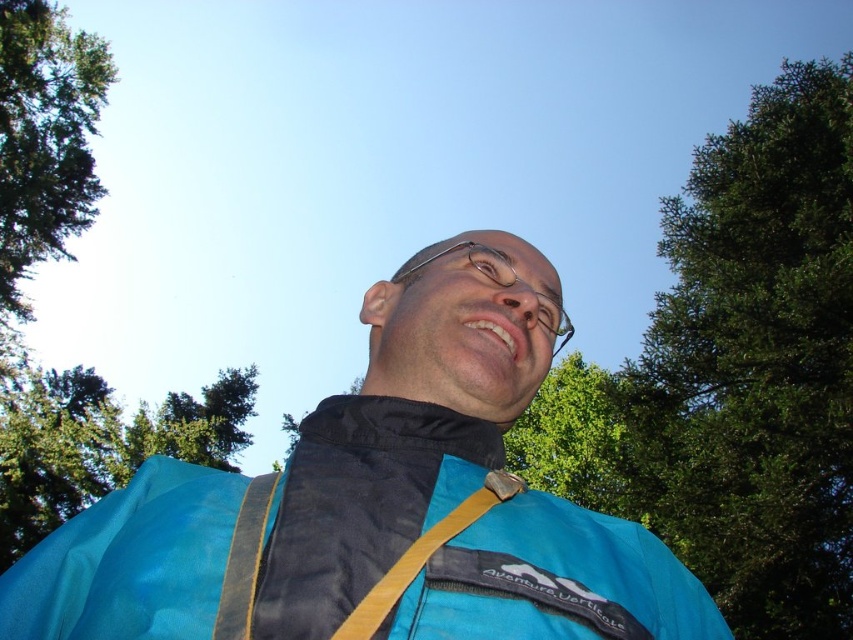
Is the position of green leafy tree at center more distant than that of yellow fabric strap at center?

Yes, it is.

Looking at this image, between green leafy tree at center and yellow fabric strap at center, which one is positioned lower?

green leafy tree at center is lower down.

Identify the location of green leafy tree at center. This screenshot has height=640, width=853. (577, 440).

Locate an element on the screen. The width and height of the screenshot is (853, 640). green leafy tree at center is located at coordinates (577, 440).

Is blue fabric jacket at center further to the viewer compared to yellow fabric strap at center?

Yes, it is.

Describe the element at coordinates (376, 502) in the screenshot. I see `blue fabric jacket at center` at that location.

Between point (218, 600) and point (456, 516), which one is positioned behind?

The point (456, 516) is behind.

At what (x,y) coordinates should I click in order to perform the action: click on blue fabric jacket at center. Please return your answer as a coordinate pair (x, y). This screenshot has width=853, height=640. Looking at the image, I should click on (376, 502).

Does green leafy tree at center have a lesser height compared to clear plastic glasses at center?

Incorrect, green leafy tree at center's height does not fall short of clear plastic glasses at center's.

Does green leafy tree at center have a smaller size compared to clear plastic glasses at center?

Actually, green leafy tree at center might be larger than clear plastic glasses at center.

This screenshot has height=640, width=853. I want to click on green leafy tree at center, so click(577, 440).